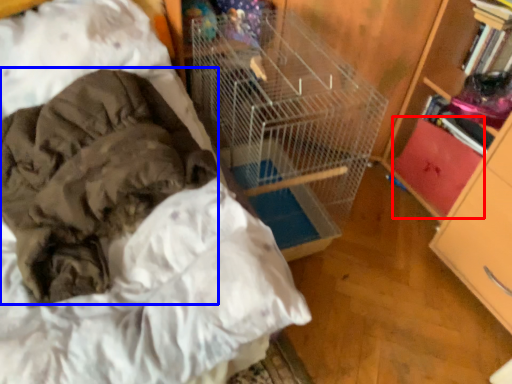
Question: Which object is further to the camera taking this photo, drawer (highlighted by a red box) or clothing (highlighted by a blue box)?

Choices:
 (A) drawer
 (B) clothing

Answer: (A)